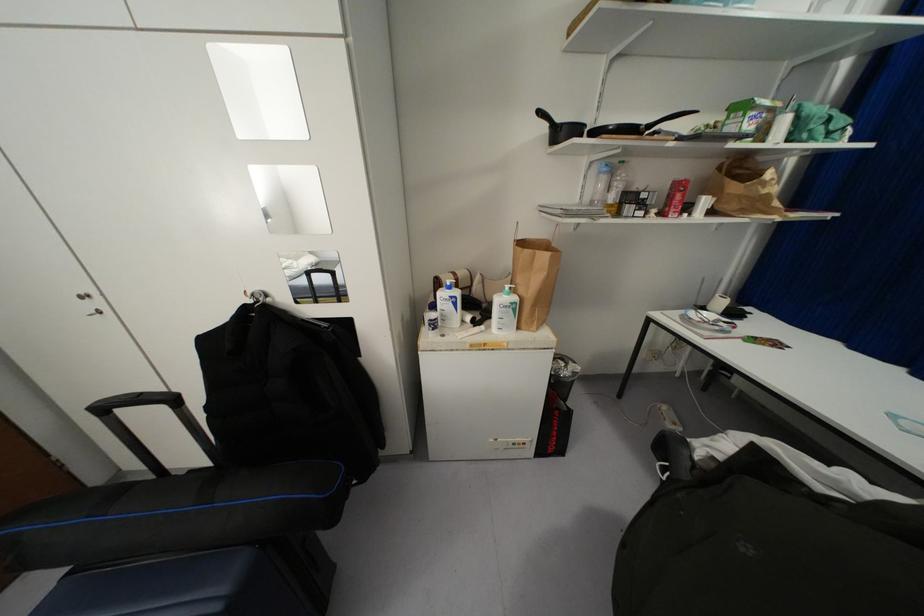
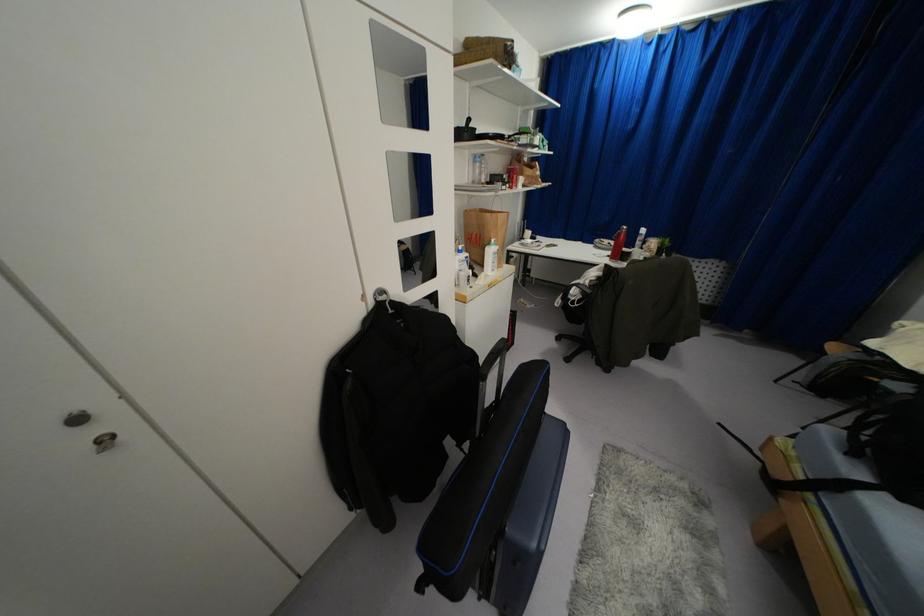
Where in the second image is the point corresponding to point 515,298 from the first image?

(495, 246)